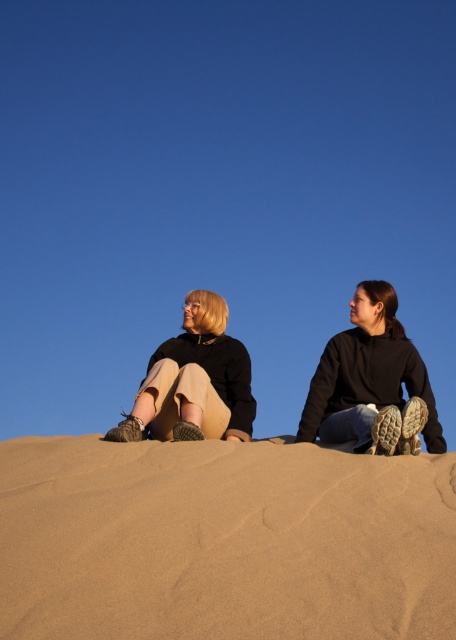
Who is more forward, (362, 365) or (212, 324)?

Point (362, 365) is more forward.

Who is lower down, matte black jackets at center or matte black sweater at center?

Positioned lower is matte black jackets at center.

Is point (373, 378) behind point (195, 396)?

Yes.

At what (x,y) coordinates should I click in order to perform the action: click on matte black jackets at center. Please return your answer as a coordinate pair (x, y). Looking at the image, I should click on (372, 384).

Is black hoodie at upper right further to camera compared to matte black sweater at center?

No, it is in front of matte black sweater at center.

Who is positioned more to the right, black hoodie at upper right or matte black sweater at center?

black hoodie at upper right

At what (x,y) coordinates should I click in order to perform the action: click on black hoodie at upper right. Please return your answer as a coordinate pair (x, y). Image resolution: width=456 pixels, height=640 pixels. Looking at the image, I should click on [x=372, y=384].

In order to click on black hoodie at upper right in this screenshot , I will do 372,384.

Measure the distance from matte black jackets at center to black hoodie at upper right.

The distance of matte black jackets at center from black hoodie at upper right is 0.69 inches.

Is point (306, 413) positioned in front of point (385, 348)?

Yes.

Find the location of a particular element. This screenshot has width=456, height=640. matte black jackets at center is located at coordinates (372, 384).